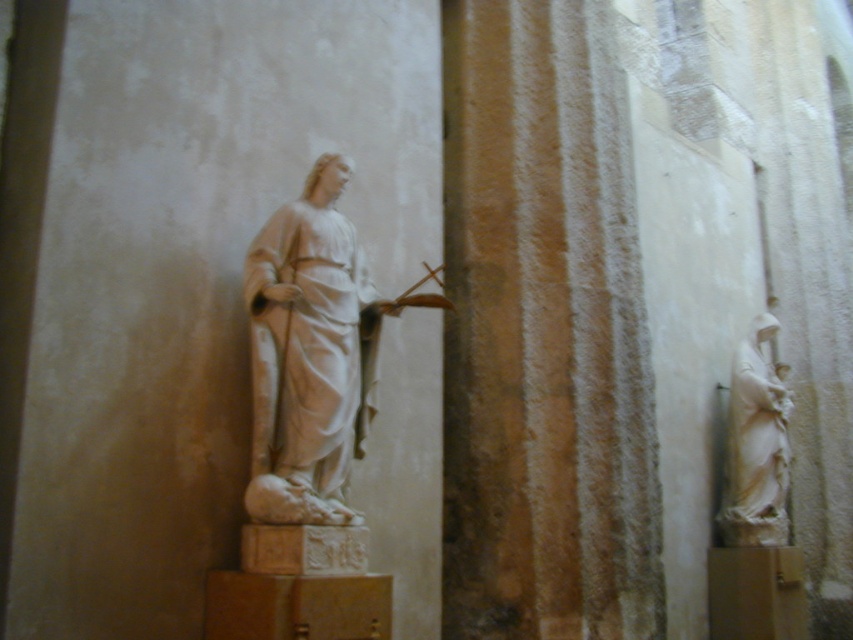
Does white marble statue at center come in front of white marble statue at right?

Yes, it is.

Between white marble statue at center and white marble statue at right, which one is positioned higher?

white marble statue at center is above.

What do you see at coordinates (310, 348) in the screenshot?
I see `white marble statue at center` at bounding box center [310, 348].

Locate an element on the screen. The image size is (853, 640). white marble statue at center is located at coordinates (310, 348).